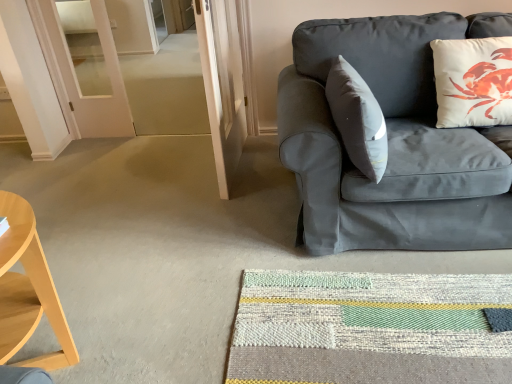
Question: Does white matte pillow at upper right have a greater width compared to matte gray couch at right?

Choices:
 (A) yes
 (B) no

Answer: (B)

Question: Can you confirm if white matte pillow at upper right is positioned to the right of matte gray couch at right?

Choices:
 (A) yes
 (B) no

Answer: (A)

Question: Is white matte pillow at upper right positioned in front of matte gray couch at right?

Choices:
 (A) no
 (B) yes

Answer: (A)

Question: Is white matte pillow at upper right positioned behind matte gray couch at right?

Choices:
 (A) no
 (B) yes

Answer: (B)

Question: Would you say white matte pillow at upper right contains matte gray couch at right?

Choices:
 (A) no
 (B) yes

Answer: (A)

Question: Are white matte pillow at upper right and matte gray couch at right far apart?

Choices:
 (A) yes
 (B) no

Answer: (B)

Question: Is textured woven mat at lower center to the right of light wood/wooden desk at left from the viewer's perspective?

Choices:
 (A) no
 (B) yes

Answer: (B)

Question: Is textured woven mat at lower center closer to camera compared to light wood/wooden desk at left?

Choices:
 (A) yes
 (B) no

Answer: (B)

Question: From the image's perspective, is textured woven mat at lower center located beneath light wood/wooden desk at left?

Choices:
 (A) no
 (B) yes

Answer: (B)

Question: From a real-world perspective, is textured woven mat at lower center located higher than light wood/wooden desk at left?

Choices:
 (A) no
 (B) yes

Answer: (A)

Question: From the image's perspective, is textured woven mat at lower center on light wood/wooden desk at left?

Choices:
 (A) no
 (B) yes

Answer: (A)

Question: Is textured woven mat at lower center in contact with light wood/wooden desk at left?

Choices:
 (A) no
 (B) yes

Answer: (A)

Question: Is light wood/wooden desk at left at the left side of textured woven mat at lower center?

Choices:
 (A) no
 (B) yes

Answer: (B)